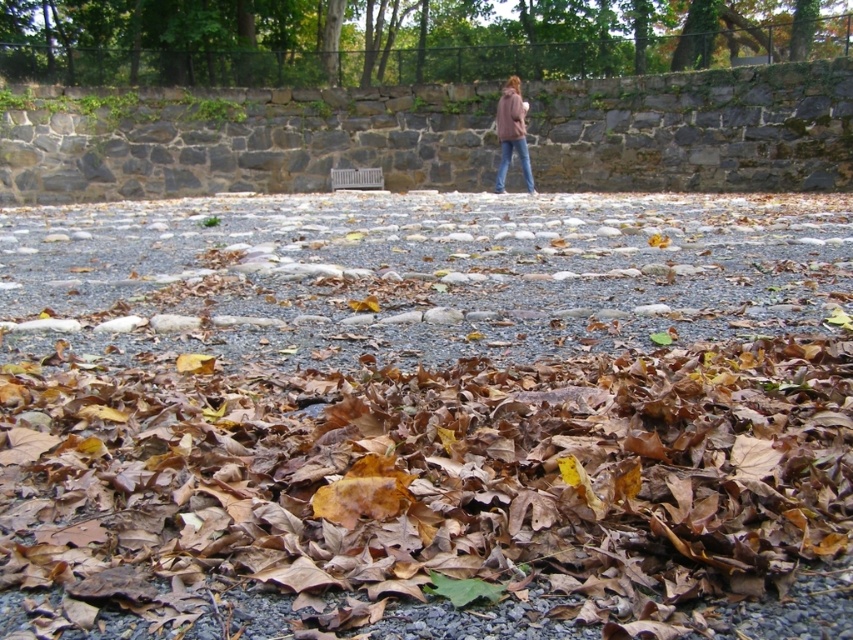
From the picture: You are standing at the point closer to the camera in the image. Which point are you at, point (732, 472) or point (494, 189)?

You are at point (732, 472) because it is closer to the camera than point (494, 189).

You are standing on the cobblestone path and see the matte pink hoodie at upper right and the blue jeans at center. Which item is closer to you?

The matte pink hoodie at upper right is closer to you because it is in front of the blue jeans at center.